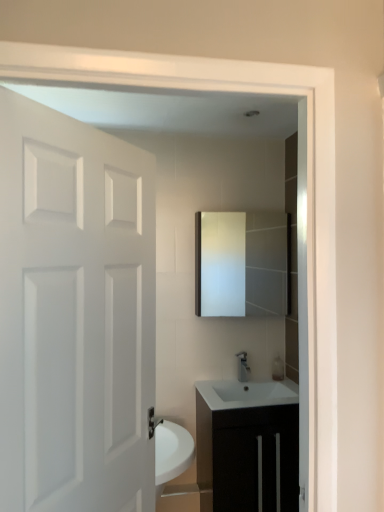
In order to face black matte cabinet at lower center, should I rotate leftwards or rightwards?

Rotate your view right by about 7.971°.

Identify the location of matte white mirror at center. [242, 264].

From the image's perspective, is black matte cabinet at lower center located above or below matte white mirror at center?

black matte cabinet at lower center is below matte white mirror at center.

Between black matte cabinet at lower center and matte white mirror at center, which one has more height?

black matte cabinet at lower center.

Does black matte cabinet at lower center turn towards matte white mirror at center?

No, black matte cabinet at lower center is not aimed at matte white mirror at center.

Can you tell me how much matte white mirror at center and white matte door at left differ in facing direction?

54.3 degrees.

Is matte white mirror at center oriented towards white matte door at left?

No.

Does matte white mirror at center touch white matte door at left?

No, matte white mirror at center is not next to white matte door at left.

Looking at the image, does matte white mirror at center seem bigger or smaller compared to white matte door at left?

Considering their sizes, matte white mirror at center takes up less space than white matte door at left.

Between point (243, 379) and point (238, 435), which one is positioned behind?

The point (243, 379) is more distant.

From the picture: Is satin nickel faucet at center further to the viewer compared to black matte cabinet at lower center?

Yes, it is.

I want to click on tap that is above the black matte cabinet at lower center (from the image's perspective), so click(x=243, y=367).

Looking at this image, from a real-world perspective, relative to black matte cabinet at lower center, is satin nickel faucet at center vertically above or below?

From a real-world perspective, satin nickel faucet at center is physically above black matte cabinet at lower center.

From a real-world perspective, is matte white mirror at center positioned over satin nickel faucet at center based on gravity?

Yes, from a real-world perspective, matte white mirror at center is on top of satin nickel faucet at center.

Is matte white mirror at center not inside satin nickel faucet at center?

Yes, matte white mirror at center is not within satin nickel faucet at center.

Who is bigger, matte white mirror at center or satin nickel faucet at center?

matte white mirror at center.

Would you say black matte cabinet at lower center is a long distance from white matte door at left?

Yes, black matte cabinet at lower center is far from white matte door at left.

Is point (289, 453) closer to viewer compared to point (77, 459)?

No.

Is white matte door at left at the back of black matte cabinet at lower center?

No.

From a real-world perspective, who is located higher, black matte cabinet at lower center or white matte door at left?

white matte door at left.

Is point (246, 378) closer or farther from the camera than point (277, 220)?

Clearly, point (246, 378) is closer to the camera than point (277, 220).

What's the angular difference between satin nickel faucet at center and matte white mirror at center's facing directions?

There is a 0.763-degree angle between the facing directions of satin nickel faucet at center and matte white mirror at center.

From the image's perspective, relative to matte white mirror at center, is satin nickel faucet at center above or below?

Clearly, from the image's perspective, satin nickel faucet at center is below matte white mirror at center.

Is matte white mirror at center inside satin nickel faucet at center?

No, matte white mirror at center is located outside of satin nickel faucet at center.

Is matte white mirror at center taller or shorter than black matte cabinet at lower center?

Considering their sizes, matte white mirror at center has less height than black matte cabinet at lower center.

How many degrees apart are the facing directions of matte white mirror at center and black matte cabinet at lower center?

The facing directions of matte white mirror at center and black matte cabinet at lower center are 0.707 degrees apart.

Considering the points (229, 247) and (290, 396), which point is behind, point (229, 247) or point (290, 396)?

The point (229, 247) is farther.

Find the location of `bathroom cabinet in front of the matte white mirror at center`. bathroom cabinet in front of the matte white mirror at center is located at coordinates (248, 445).

Where is `mirror on the right of white matte door at left`? This screenshot has height=512, width=384. mirror on the right of white matte door at left is located at coordinates (242, 264).

Estimate the real-world distances between objects in this image. Which object is further from black matte cabinet at lower center, white matte door at left or satin nickel faucet at center?

white matte door at left lies further to black matte cabinet at lower center than the other object.

When comparing their distances from black matte cabinet at lower center, does matte white mirror at center or white matte door at left seem further?

white matte door at left.

From the image, which object appears to be farther from white matte door at left, black matte cabinet at lower center or satin nickel faucet at center?

satin nickel faucet at center is further to white matte door at left.

Which object lies nearer to the anchor point matte white mirror at center, white matte door at left or black matte cabinet at lower center?

black matte cabinet at lower center.

From the picture: Looking at the image, which one is located further to black matte cabinet at lower center, satin nickel faucet at center or matte white mirror at center?

matte white mirror at center is further to black matte cabinet at lower center.

Estimate the real-world distances between objects in this image. Which object is closer to black matte cabinet at lower center, white matte door at left or matte white mirror at center?

Among the two, matte white mirror at center is located nearer to black matte cabinet at lower center.

Considering their positions, is black matte cabinet at lower center positioned closer to matte white mirror at center than satin nickel faucet at center?

The object closer to matte white mirror at center is satin nickel faucet at center.

Based on their spatial positions, is black matte cabinet at lower center or white matte door at left closer to matte white mirror at center?

Based on the image, black matte cabinet at lower center appears to be nearer to matte white mirror at center.

Locate an element on the screen. The width and height of the screenshot is (384, 512). bathroom cabinet between white matte door at left and matte white mirror at center along the z-axis is located at coordinates (248, 445).

This screenshot has height=512, width=384. I want to click on bathroom cabinet positioned between white matte door at left and satin nickel faucet at center from near to far, so click(248, 445).

In order to click on tap between matte white mirror at center and black matte cabinet at lower center from top to bottom in this screenshot , I will do `click(243, 367)`.

Where is `mirror between white matte door at left and satin nickel faucet at center along the z-axis`? The width and height of the screenshot is (384, 512). mirror between white matte door at left and satin nickel faucet at center along the z-axis is located at coordinates (242, 264).